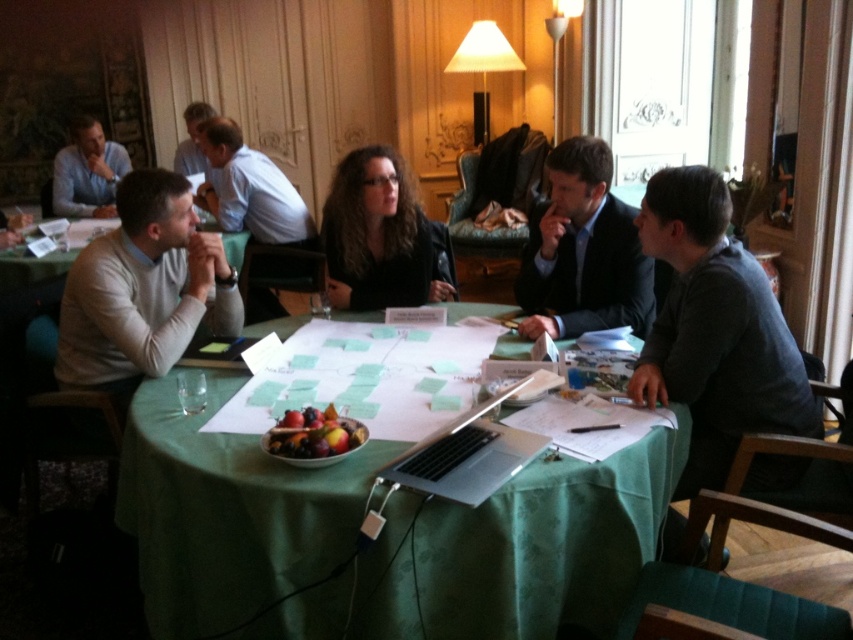
Question: Based on their relative distances, which object is nearer to the light beige sweater at left?

Choices:
 (A) green fabric tablecloth at center
 (B) silver metallic laptop at center
 (C) light brown leather jacket at center
 (D) dark blue suit at center

Answer: (A)

Question: Which point appears closest to the camera in this image?

Choices:
 (A) (712, 186)
 (B) (71, 269)
 (C) (596, 304)
 (D) (479, 563)

Answer: (D)

Question: Where is green fabric tablecloth at center located in relation to light beige sweater at left in the image?

Choices:
 (A) left
 (B) right

Answer: (B)

Question: Considering the real-world distances, which object is closest to the dark blue suit at center?

Choices:
 (A) silver metallic laptop at center
 (B) light brown leather jacket at center
 (C) dark gray sweater at right

Answer: (C)

Question: Is black leather jacket at center smaller than light brown leather jacket at center?

Choices:
 (A) yes
 (B) no

Answer: (A)

Question: Can you confirm if dark gray sweater at right is smaller than glossy plastic fruit bowl at center?

Choices:
 (A) no
 (B) yes

Answer: (A)